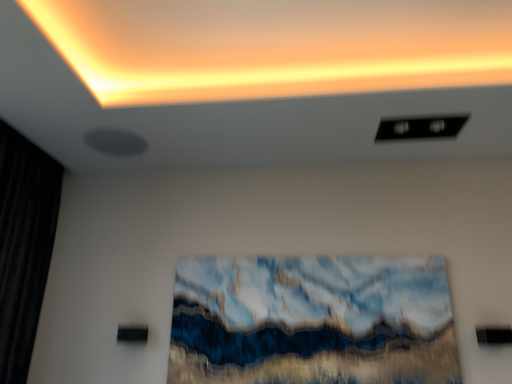
This screenshot has width=512, height=384. I want to click on textured blue and white abstract painting at center, so click(x=313, y=321).

Locate an element on the screen. This screenshot has height=384, width=512. matte orange glow at upper center is located at coordinates (275, 47).

What do you see at coordinates (24, 245) in the screenshot?
I see `black fabric curtain at left` at bounding box center [24, 245].

This screenshot has width=512, height=384. I want to click on textured blue and white abstract painting at center, so click(x=313, y=321).

Is black fabric curtain at left facing towards textured blue and white abstract painting at center?

Yes, black fabric curtain at left is facing textured blue and white abstract painting at center.

From their relative heights in the image, would you say black fabric curtain at left is taller or shorter than textured blue and white abstract painting at center?

black fabric curtain at left is taller than textured blue and white abstract painting at center.

Is black fabric curtain at left positioned beyond the bounds of textured blue and white abstract painting at center?

That's correct, black fabric curtain at left is outside of textured blue and white abstract painting at center.

Is black fabric curtain at left smaller than textured blue and white abstract painting at center?

Actually, black fabric curtain at left might be larger than textured blue and white abstract painting at center.

Consider the image. Considering the positions of objects matte orange glow at upper center and black fabric curtain at left in the image provided, who is behind, matte orange glow at upper center or black fabric curtain at left?

black fabric curtain at left.

From a real-world perspective, which is physically below, matte orange glow at upper center or black fabric curtain at left?

In real-world perspective, black fabric curtain at left is lower.

In the scene shown: Is matte orange glow at upper center bigger than black fabric curtain at left?

No.

How distant is matte orange glow at upper center from textured blue and white abstract painting at center?

They are 37.26 inches apart.

Can you tell me how much matte orange glow at upper center and textured blue and white abstract painting at center differ in facing direction?

The facing directions of matte orange glow at upper center and textured blue and white abstract painting at center are 90.4 degrees apart.

Based on the photo, considering their positions, is matte orange glow at upper center located in front of or behind textured blue and white abstract painting at center?

matte orange glow at upper center is positioned closer to the viewer than textured blue and white abstract painting at center.

From the picture: Is matte orange glow at upper center to the right of textured blue and white abstract painting at center from the viewer's perspective?

No, matte orange glow at upper center is not to the right of textured blue and white abstract painting at center.

Between black fabric curtain at left and matte orange glow at upper center, which one has smaller size?

With smaller size is matte orange glow at upper center.

From a real-world perspective, is black fabric curtain at left on top of matte orange glow at upper center?

Incorrect, from a real-world perspective, black fabric curtain at left is lower than matte orange glow at upper center.

Between point (46, 156) and point (212, 98), which one is positioned behind?

Point (46, 156)

Are textured blue and white abstract painting at center and matte orange glow at upper center making contact?

They are not placed beside each other.

Does textured blue and white abstract painting at center appear on the left side of matte orange glow at upper center?

No.

Where is `glow above the textured blue and white abstract painting at center (from a real-world perspective)`? The image size is (512, 384). glow above the textured blue and white abstract painting at center (from a real-world perspective) is located at coordinates (275, 47).

Could you tell me if textured blue and white abstract painting at center is facing matte orange glow at upper center?

No, textured blue and white abstract painting at center does not turn towards matte orange glow at upper center.

Would you say textured blue and white abstract painting at center contains black fabric curtain at left?

No, textured blue and white abstract painting at center does not contain black fabric curtain at left.

Considering the sizes of objects textured blue and white abstract painting at center and black fabric curtain at left in the image provided, who is taller, textured blue and white abstract painting at center or black fabric curtain at left?

black fabric curtain at left is taller.

Is point (234, 264) behind point (26, 274)?

That is True.

Who is more distant, textured blue and white abstract painting at center or black fabric curtain at left?

textured blue and white abstract painting at center is further away from the camera.

Where is `curtain that appears above the textured blue and white abstract painting at center (from a real-world perspective)`? curtain that appears above the textured blue and white abstract painting at center (from a real-world perspective) is located at coordinates (24, 245).

The height and width of the screenshot is (384, 512). What are the coordinates of `curtain located behind the matte orange glow at upper center` in the screenshot? It's located at (24, 245).

When comparing their distances from textured blue and white abstract painting at center, does matte orange glow at upper center or black fabric curtain at left seem closer?

The object closer to textured blue and white abstract painting at center is matte orange glow at upper center.

Based on their spatial positions, is textured blue and white abstract painting at center or matte orange glow at upper center closer to black fabric curtain at left?

matte orange glow at upper center lies closer to black fabric curtain at left than the other object.

From the image, which object appears to be nearer to textured blue and white abstract painting at center, black fabric curtain at left or matte orange glow at upper center?

Based on the image, matte orange glow at upper center appears to be nearer to textured blue and white abstract painting at center.

From the image, which object appears to be nearer to black fabric curtain at left, matte orange glow at upper center or textured blue and white abstract painting at center?

matte orange glow at upper center is positioned closer to the anchor black fabric curtain at left.

In the scene shown: When comparing their distances from matte orange glow at upper center, does black fabric curtain at left or textured blue and white abstract painting at center seem further?

Among the two, black fabric curtain at left is located further to matte orange glow at upper center.

Looking at the image, which one is located closer to matte orange glow at upper center, textured blue and white abstract painting at center or black fabric curtain at left?

Among the two, textured blue and white abstract painting at center is located nearer to matte orange glow at upper center.

You are a GUI agent. You are given a task and a screenshot of the screen. Output one action in this format:
    pyautogui.click(x=<x>, y=<y>)
    Task: Click on the glow located between black fabric curtain at left and textured blue and white abstract painting at center in the left-right direction
    This screenshot has width=512, height=384.
    Given the screenshot: What is the action you would take?
    pyautogui.click(x=275, y=47)